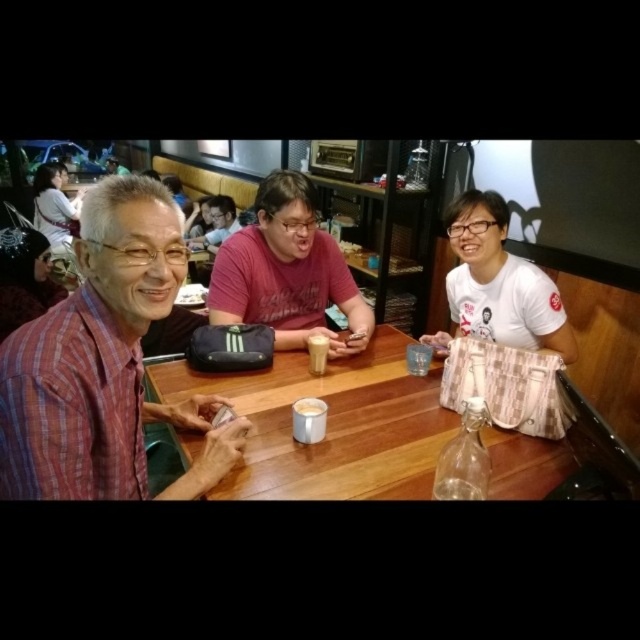
You are a customer at this cafe and want to place your phone on the table. You have two options on the table, the white matte paper at upper center and the white frothy foam at center. Which surface is closer to you where you can easily reach?

The white matte paper at upper center is closer to you than the white frothy foam at center, so you can easily reach it.

What is the position of the plaid fabric shirt at left relative to the point marked at coordinates (104, 364)?

The point at (104, 364) marks the location of the plaid fabric shirt at left.